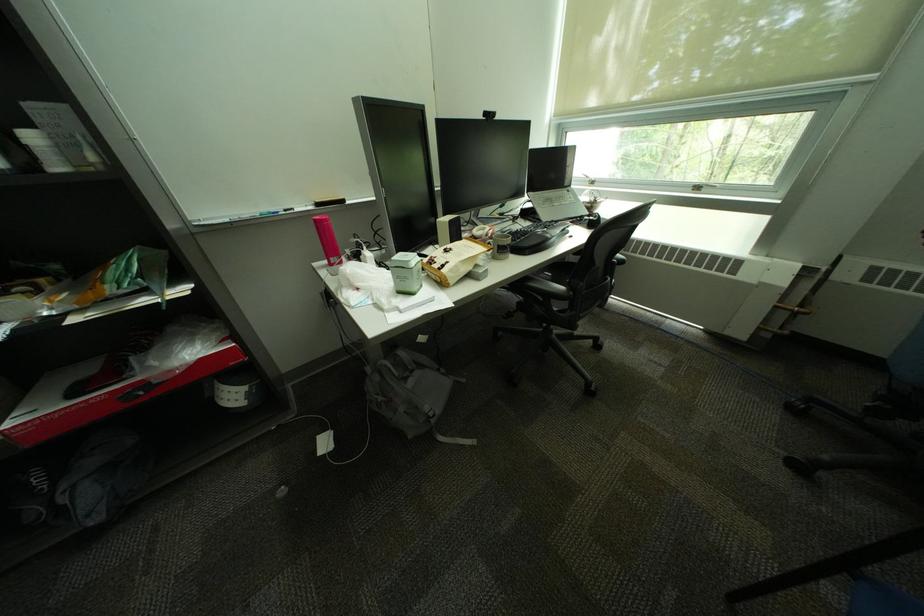
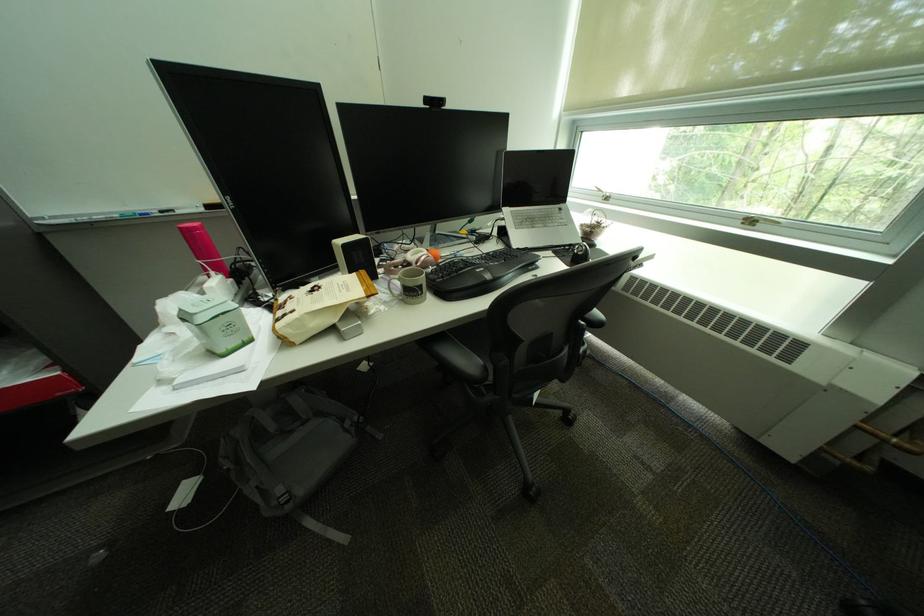
Locate, in the second image, the point that corresponds to point 591,217 in the first image.

(580, 246)